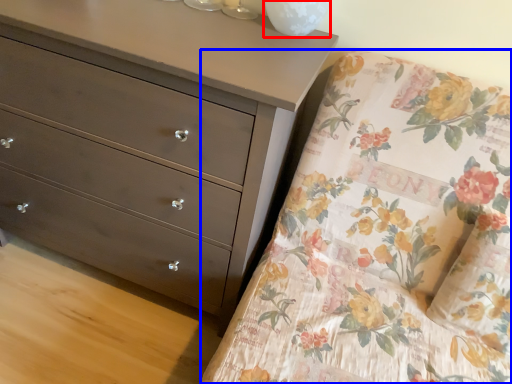
Question: Which point is further to the camera, glass vase (highlighted by a red box) or mattress (highlighted by a blue box)?

Choices:
 (A) glass vase
 (B) mattress

Answer: (A)